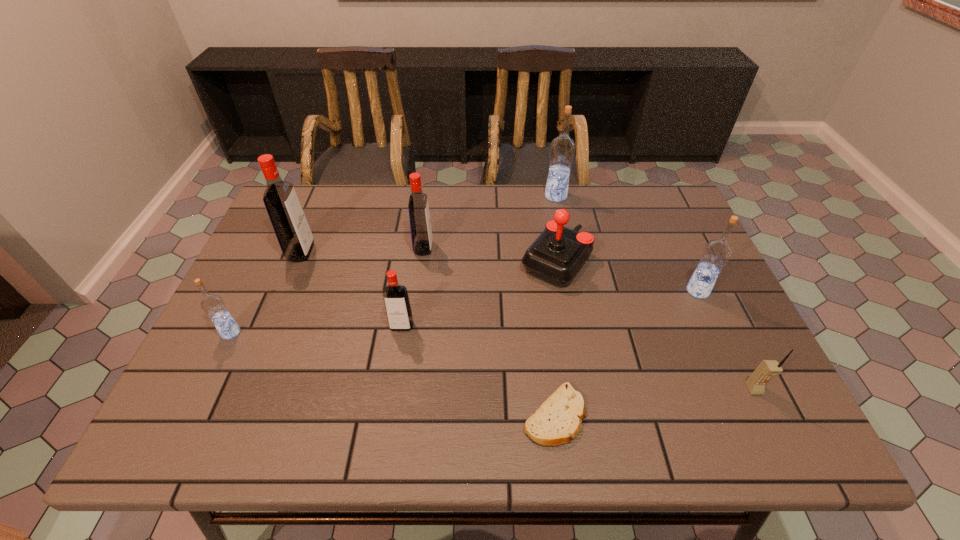
You are a GUI agent. You are given a task and a screenshot of the screen. Output one action in this format:
    pyautogui.click(x=<x>, y=<y>)
    Task: Click on the free region located on the left of the pita bread
    Image resolution: width=960 pixels, height=540 pixels.
    Given the screenshot: What is the action you would take?
    pyautogui.click(x=326, y=415)

What are the coordinates of `object that is at the far edge` in the screenshot? It's located at (562, 148).

The image size is (960, 540). What are the coordinates of `object that is at the near edge` in the screenshot? It's located at (558, 420).

Locate an element on the screen. vodka at the right edge is located at coordinates (716, 253).

This screenshot has width=960, height=540. Identify the location of cellular telephone that is at the right edge. (766, 369).

The height and width of the screenshot is (540, 960). What are the coordinates of `vacant space at the far edge of the desktop` in the screenshot? It's located at tap(506, 222).

Identify the location of free point at the near edge. (310, 410).

Image resolution: width=960 pixels, height=540 pixels. I want to click on free space at the left edge of the desktop, so click(234, 367).

Identify the location of vacant space at the right edge of the desktop. This screenshot has height=540, width=960. (704, 402).

This screenshot has height=540, width=960. What are the coordinates of `free space at the far left corner of the desktop` in the screenshot? It's located at 320,212.